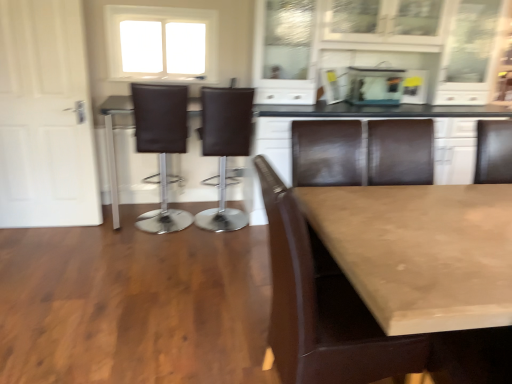
Question: From a real-world perspective, does brown leather bar stool at center, which is the 2th chair in front-to-back order, sit lower than brown leather chair at center, the first chair positioned from the front?

Choices:
 (A) no
 (B) yes

Answer: (A)

Question: Is brown leather bar stool at center, which is the 2th chair in front-to-back order, outside brown leather chair at center, which is the 3th chair in back-to-front order?

Choices:
 (A) no
 (B) yes

Answer: (B)

Question: Is brown leather bar stool at center, which is the 2th chair in front-to-back order, wider than brown leather chair at center, which is the 3th chair in back-to-front order?

Choices:
 (A) no
 (B) yes

Answer: (A)

Question: From a real-world perspective, is brown leather bar stool at center, marked as the first chair in a left-to-right arrangement, on brown leather chair at center, arranged as the first chair when viewed from the right?

Choices:
 (A) yes
 (B) no

Answer: (A)

Question: Can you confirm if brown leather bar stool at center, marked as the first chair in a left-to-right arrangement, is smaller than brown leather chair at center, arranged as the first chair when viewed from the right?

Choices:
 (A) yes
 (B) no

Answer: (A)

Question: Is white frosted glass window at upper center situated inside white matte door at left or outside?

Choices:
 (A) outside
 (B) inside

Answer: (A)

Question: In terms of width, does white frosted glass window at upper center look wider or thinner when compared to white matte door at left?

Choices:
 (A) thin
 (B) wide

Answer: (B)

Question: From a real-world perspective, is white frosted glass window at upper center physically located above or below white matte door at left?

Choices:
 (A) above
 (B) below

Answer: (A)

Question: From their relative heights in the image, would you say white frosted glass window at upper center is taller or shorter than white matte door at left?

Choices:
 (A) tall
 (B) short

Answer: (B)

Question: From the image's perspective, is smooth beige table at center above or below white matte door at left?

Choices:
 (A) below
 (B) above

Answer: (A)

Question: Looking at their shapes, would you say smooth beige table at center is wider or thinner than white matte door at left?

Choices:
 (A) wide
 (B) thin

Answer: (A)

Question: Relative to white matte door at left, is smooth beige table at center in front or behind?

Choices:
 (A) front
 (B) behind

Answer: (A)

Question: Would you say smooth beige table at center is to the left or to the right of white matte door at left in the picture?

Choices:
 (A) left
 (B) right

Answer: (B)

Question: Based on their sizes in the image, would you say white frosted glass window at upper center is bigger or smaller than brown leather bar stool at center, marked as the first chair in a left-to-right arrangement?

Choices:
 (A) big
 (B) small

Answer: (B)

Question: Is white frosted glass window at upper center situated inside brown leather bar stool at center, which is the 3th chair in right-to-left order, or outside?

Choices:
 (A) outside
 (B) inside

Answer: (A)